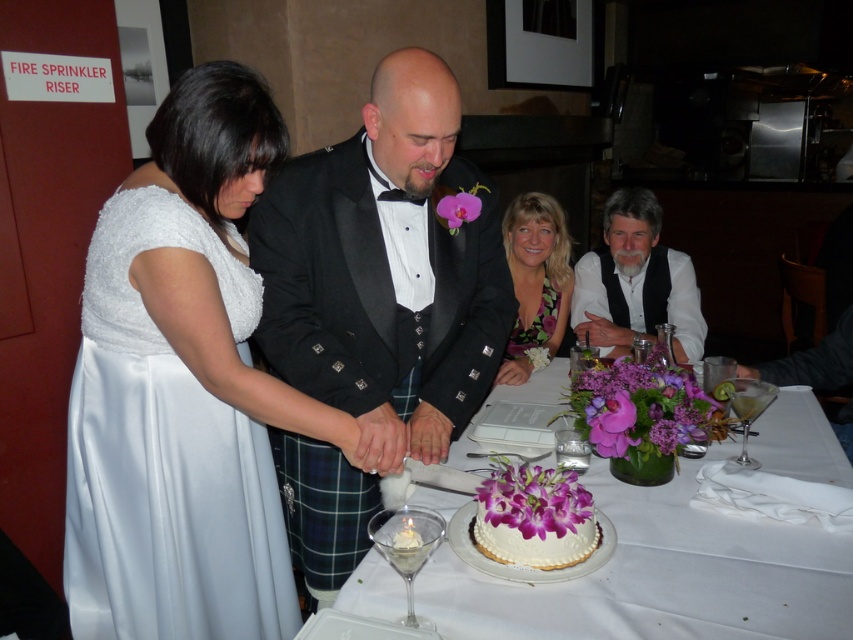
Question: Can you confirm if satin white dress at left is thinner than white textured cake at center?

Choices:
 (A) no
 (B) yes

Answer: (A)

Question: Does black satin tuxedo at center appear on the right side of white textured vest at upper right?

Choices:
 (A) yes
 (B) no

Answer: (B)

Question: Is satin white dress at left below white textured cake at center?

Choices:
 (A) yes
 (B) no

Answer: (B)

Question: Among these objects, which one is nearest to the camera?

Choices:
 (A) black satin tuxedo at center
 (B) floral print fabric dress at center

Answer: (A)

Question: Among these objects, which one is nearest to the camera?

Choices:
 (A) white frosted cake at center
 (B) white textured vest at upper right
 (C) purple floral dress at upper center
 (D) black satin tuxedo at center

Answer: (A)

Question: Which object is closer to the camera taking this photo?

Choices:
 (A) satin white dress at left
 (B) purple floral dress at upper center
 (C) black satin tuxedo at center
 (D) white textured cake at center

Answer: (D)